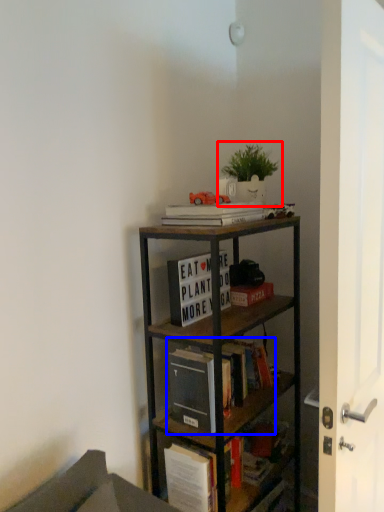
Question: Which of the following is the farthest to the observer, houseplant (highlighted by a red box) or book (highlighted by a blue box)?

Choices:
 (A) houseplant
 (B) book

Answer: (A)